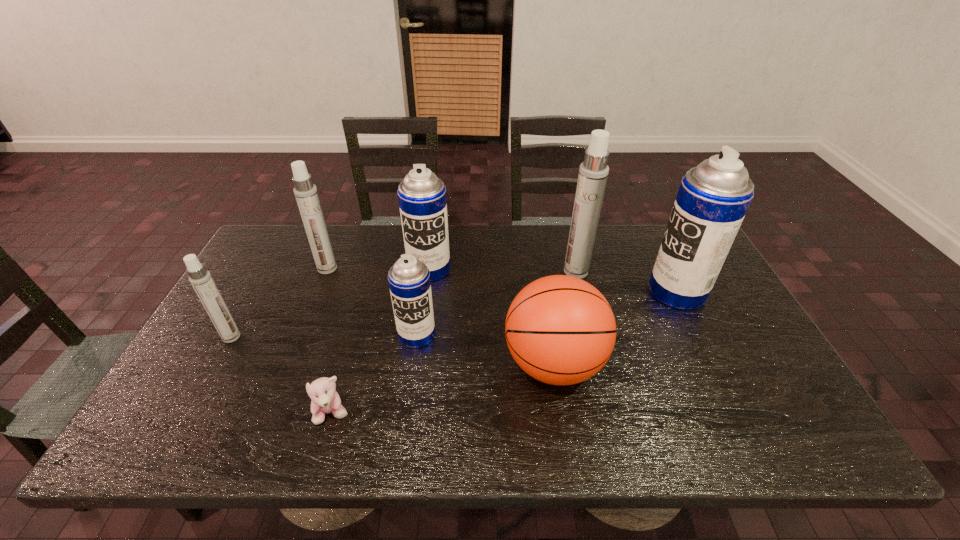
This screenshot has width=960, height=540. In order to click on vacant space located 0.240m on the label side of the nearest blue aerosol can in this screenshot , I will do `click(402, 434)`.

You are a GUI agent. You are given a task and a screenshot of the screen. Output one action in this format:
    pyautogui.click(x=<x>, y=<y>)
    Task: Click on the vacant space located 0.170m on the left of the orange basketball
    The image size is (960, 540).
    Given the screenshot: What is the action you would take?
    pyautogui.click(x=436, y=364)

I want to click on object that is at the near edge, so click(x=325, y=400).

The width and height of the screenshot is (960, 540). What are the coordinates of `object present at the left edge` in the screenshot? It's located at (200, 278).

Image resolution: width=960 pixels, height=540 pixels. I want to click on object located at the right edge, so click(713, 198).

Identify the location of vacant region at the far edge of the desktop. This screenshot has width=960, height=540. (377, 225).

The height and width of the screenshot is (540, 960). I want to click on blank space at the near edge of the desktop, so click(606, 415).

At what (x,y) coordinates should I click in order to perform the action: click on vacant space at the left edge of the desktop. Please return your answer as a coordinate pair (x, y). Image resolution: width=960 pixels, height=540 pixels. Looking at the image, I should click on (241, 277).

Where is `vacant region at the right edge of the desktop`? This screenshot has height=540, width=960. vacant region at the right edge of the desktop is located at coordinates (745, 316).

The height and width of the screenshot is (540, 960). In order to click on vacant position at the far left corner of the desktop in this screenshot , I will do `click(297, 254)`.